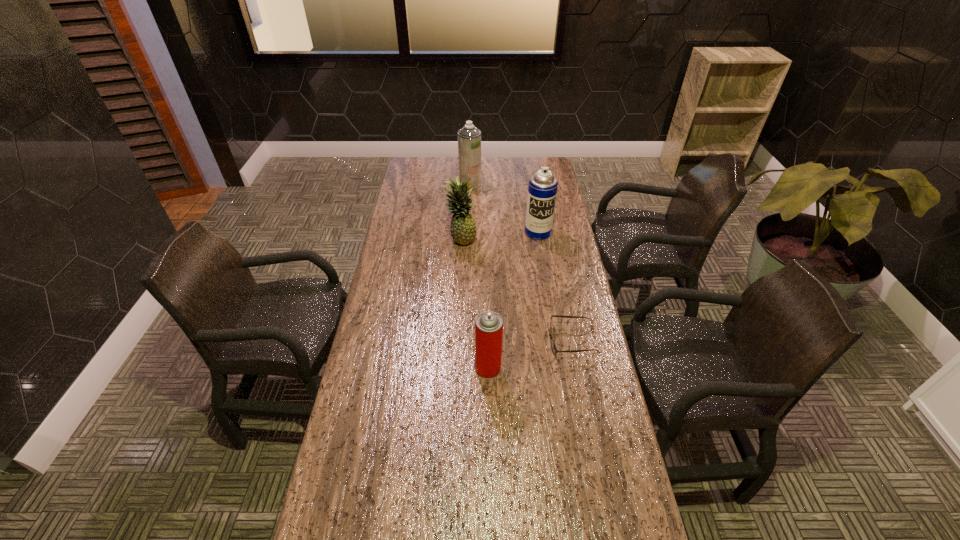
Find the location of a particular element. Image resolution: width=960 pixels, height=540 pixels. free space located 0.280m on the lenses of the shortest object is located at coordinates (463, 341).

The image size is (960, 540). In order to click on free space located 0.380m on the lenses of the shortest object in this screenshot , I will do `click(432, 341)`.

In order to click on blank space located 0.110m on the lenses of the shortest object in this screenshot , I will do `click(516, 341)`.

Image resolution: width=960 pixels, height=540 pixels. I want to click on object present at the far edge, so click(x=469, y=137).

I want to click on aerosol can at the right edge, so click(542, 190).

The width and height of the screenshot is (960, 540). I want to click on sunglasses that is at the right edge, so click(x=553, y=346).

Locate an element on the screen. The image size is (960, 540). vacant region at the far edge of the desktop is located at coordinates (514, 166).

Identify the location of vacant area at the left edge of the desktop. (420, 228).

In the image, there is a desktop. Where is `free region at the right edge`? free region at the right edge is located at coordinates (580, 528).

Identify the location of blank region between the shortest aerosol can and the farthest object. (479, 276).